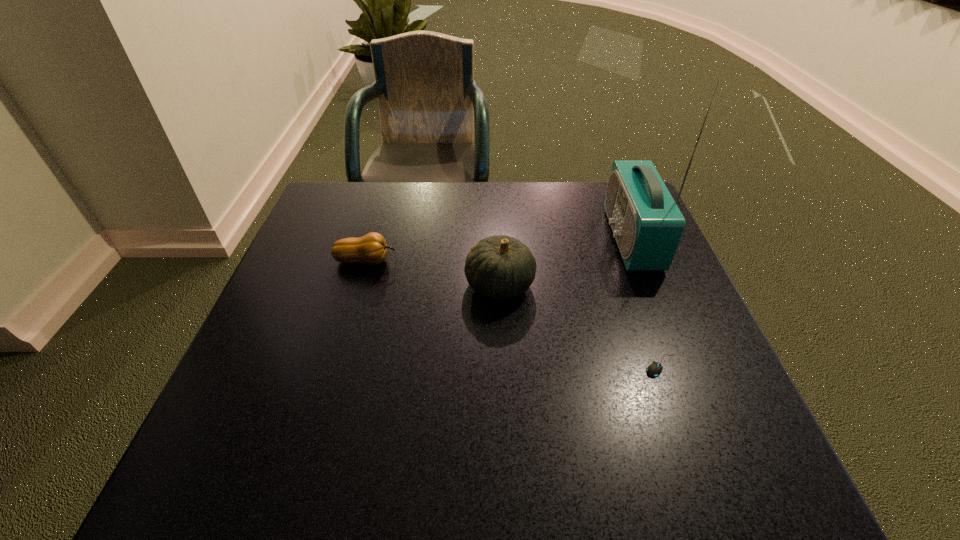
Find the location of a particular element. The image size is (960, 540). vacant space located 0.200m on the right of the second object from left to right is located at coordinates (623, 285).

Identify the location of free point located on the stem side of the leftmost object. The width and height of the screenshot is (960, 540). (531, 261).

This screenshot has height=540, width=960. Find the location of `free space located 0.160m on the front of the mouse`. free space located 0.160m on the front of the mouse is located at coordinates (698, 464).

Identify the location of object that is at the far edge. (647, 224).

Find the location of a particular element. object present at the left edge is located at coordinates (371, 248).

This screenshot has width=960, height=540. I want to click on radio receiver present at the right edge, so click(x=647, y=224).

Identify the location of mouse located at the right edge. (653, 370).

You are a GUI agent. You are given a task and a screenshot of the screen. Output one action in this format:
    pyautogui.click(x=<x>, y=<y>)
    Task: Click on the object at the far right corner
    The height and width of the screenshot is (540, 960).
    Given the screenshot: What is the action you would take?
    pyautogui.click(x=647, y=224)

This screenshot has width=960, height=540. In the image, there is a desktop. In order to click on free space at the far edge in this screenshot , I will do `click(514, 199)`.

You are a GUI agent. You are given a task and a screenshot of the screen. Output one action in this format:
    pyautogui.click(x=<x>, y=<y>)
    Task: Click on the vacant space at the near edge
    
    Given the screenshot: What is the action you would take?
    pyautogui.click(x=437, y=472)